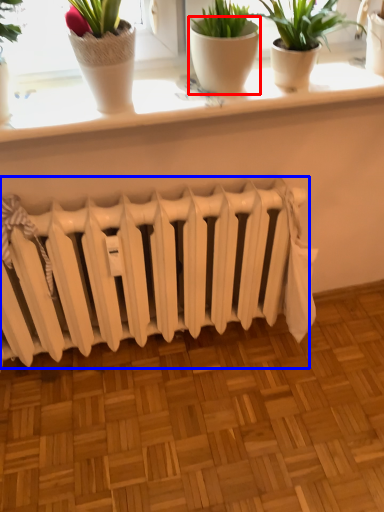
Question: Among these objects, which one is nearest to the camera, flowerpot (highlighted by a red box) or radiator (highlighted by a blue box)?

Choices:
 (A) flowerpot
 (B) radiator

Answer: (A)